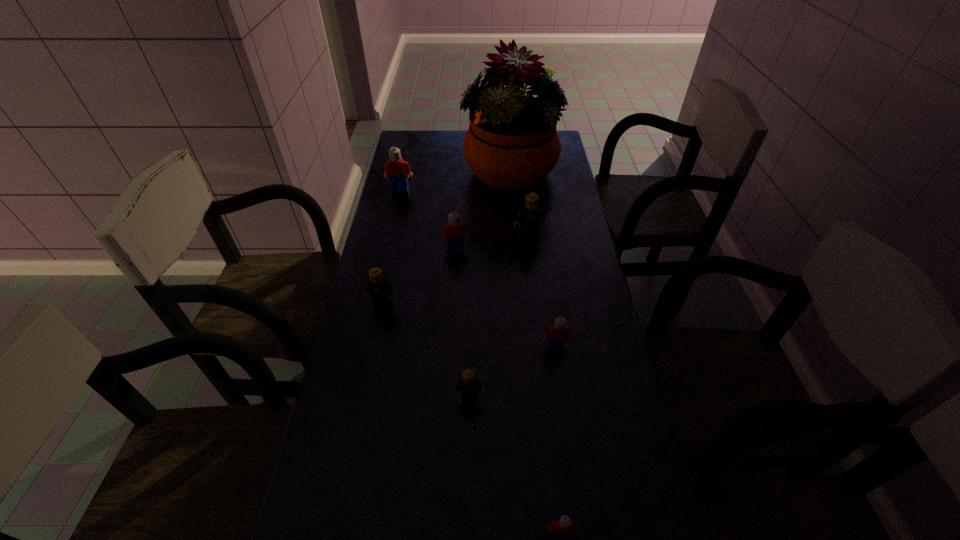
Locate an element on the screen. This screenshot has width=960, height=540. the third farthest white Lego is located at coordinates (556, 335).

You are a GUI agent. You are given a task and a screenshot of the screen. Output one action in this format:
    pyautogui.click(x=<x>, y=<y>)
    Task: Click on the second nearest Lego
    The image size is (960, 540).
    Given the screenshot: What is the action you would take?
    pyautogui.click(x=470, y=386)

Identify the location of the second tan Lego from left to right. (470, 386).

Image resolution: width=960 pixels, height=540 pixels. I want to click on the shortest object, so click(564, 526).

I want to click on the nearest object, so click(x=564, y=526).

Identify the location of blank area located on the front of the flower arrangement. Image resolution: width=960 pixels, height=540 pixels. (516, 253).

Where is `vacant region located 0.140m in front of the rightmost tan Lego`? vacant region located 0.140m in front of the rightmost tan Lego is located at coordinates (533, 269).

You are a GUI agent. You are given a task and a screenshot of the screen. Output one action in this format:
    pyautogui.click(x=<x>, y=<y>)
    Task: Click on the vacant space positioned on the face of the leftmost white Lego
    The height and width of the screenshot is (540, 960).
    Given the screenshot: What is the action you would take?
    pyautogui.click(x=393, y=223)

This screenshot has width=960, height=540. In order to click on free region located 0.330m in front of the fourth nearest Lego in this screenshot , I will do `click(361, 413)`.

Identify the location of free region located on the face of the third smallest white Lego. The image size is (960, 540). (453, 294).